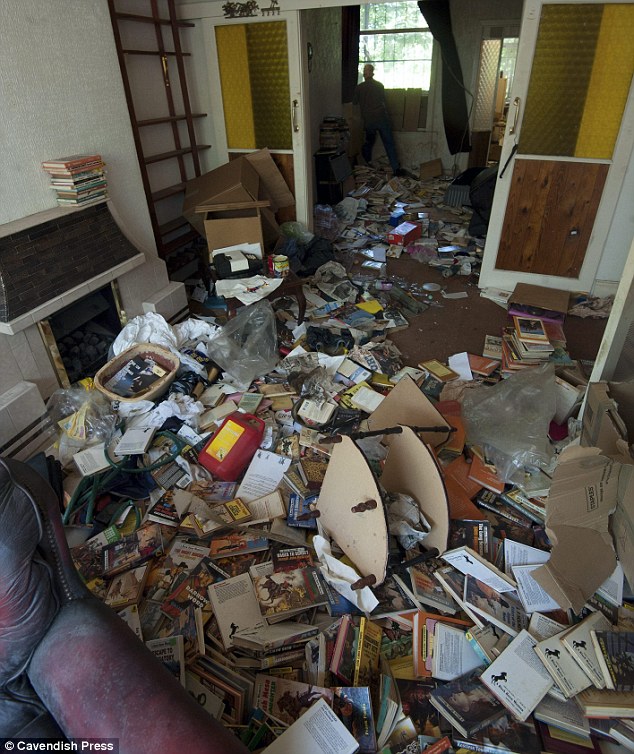
Locate an element on the screen. The image size is (634, 754). jug is located at coordinates (217, 458).